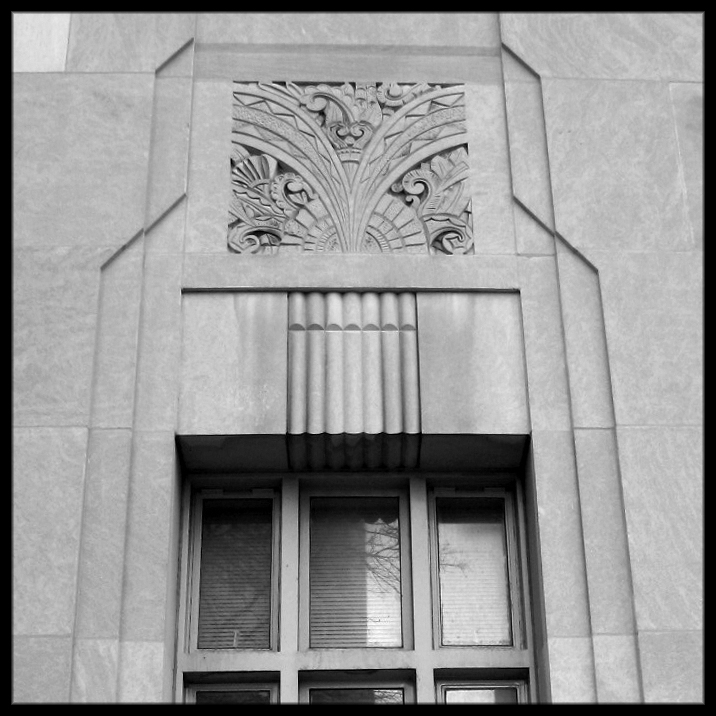
Where is `window`? Image resolution: width=716 pixels, height=716 pixels. window is located at coordinates (316, 654).